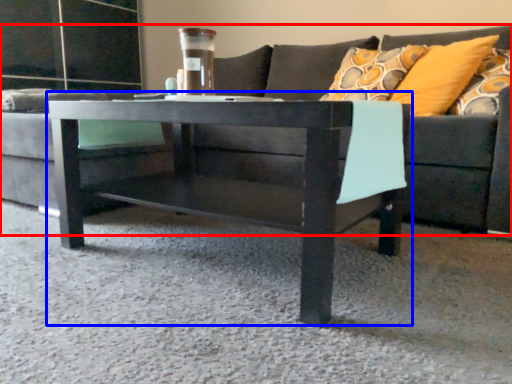
Question: Among these objects, which one is nearest to the camera, studio couch (highlighted by a red box) or coffee table (highlighted by a blue box)?

Choices:
 (A) studio couch
 (B) coffee table

Answer: (A)